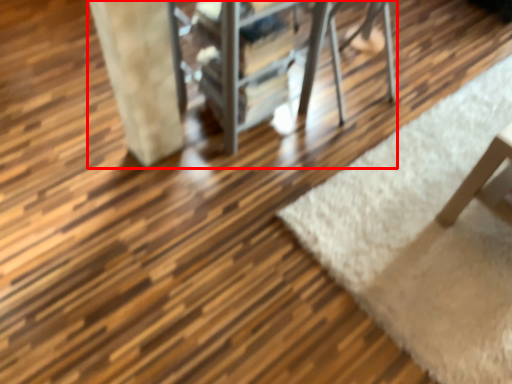
Question: Where is furniture (annotated by the red box) located in relation to mat in the image?

Choices:
 (A) left
 (B) right

Answer: (A)